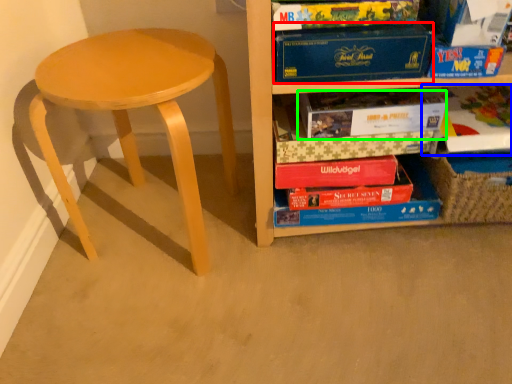
Question: Based on their relative distances, which object is nearer to paperback book (highlighted by a red box)? Choose from book (highlighted by a blue box) and paperback book (highlighted by a green box).

Choices:
 (A) book
 (B) paperback book

Answer: (B)